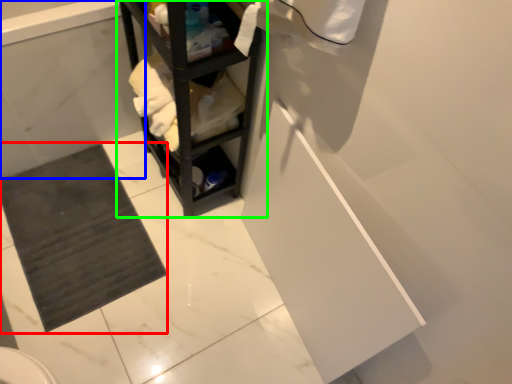
Question: Based on their relative distances, which object is nearer to bath mat (highlighted by a red box)? Choose from bath (highlighted by a blue box) and shelf (highlighted by a green box).

Choices:
 (A) bath
 (B) shelf

Answer: (A)